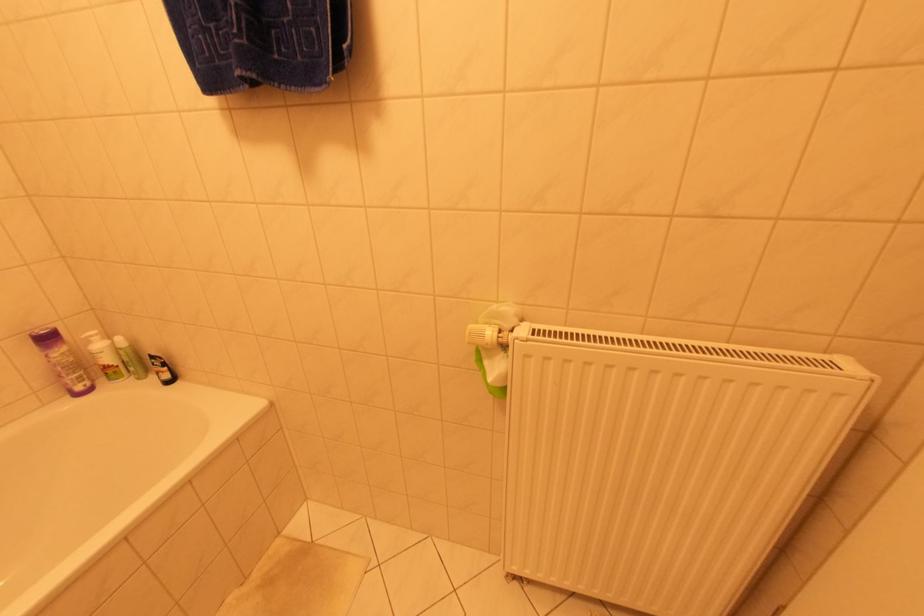
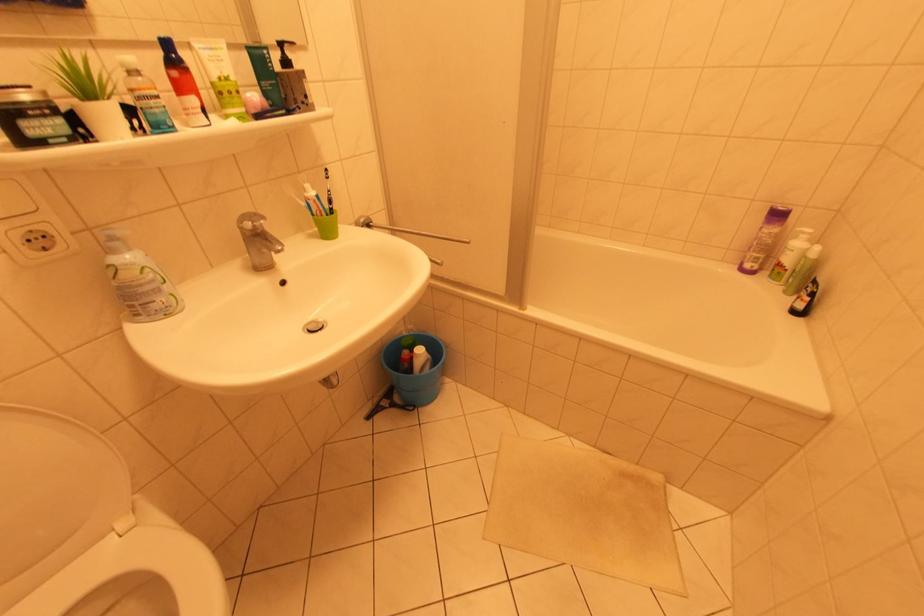
How did the camera likely rotate?

The rotation direction of the camera is left-down.